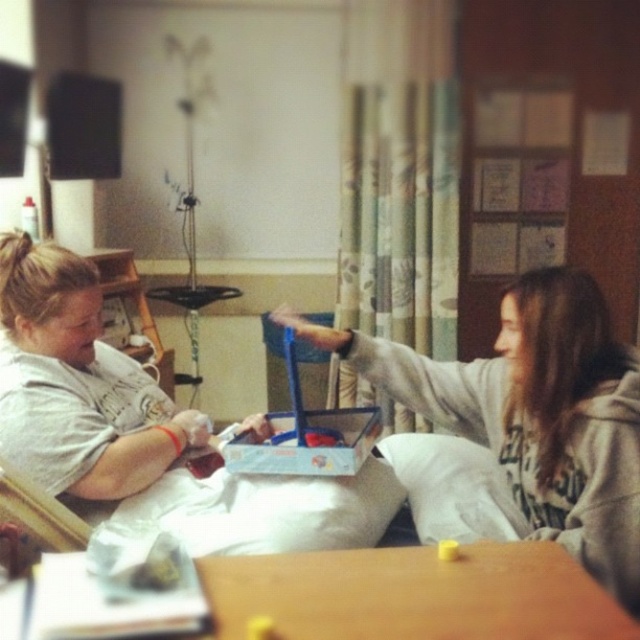
You are a delivery robot trying to locate the gray fleece hoodie at upper right in the room. According to the coordinates provided, where should you move to find it?

The gray fleece hoodie at upper right is located at point (536, 413), so you should move to that coordinate to find it.

Consider the image. You are a delivery robot with a package that needs to be placed on the wooden table at center. The gray fleece hoodie at upper right is in the way. Can you move the package around the hoodie to reach the table?

The distance between the gray fleece hoodie at upper right and the wooden table at center is 21.06 inches. Since the robot needs to navigate around the hoodie, this distance may be sufficient depending on the robot size and maneuverability. If the robot can maneuver within that space, it should be possible to reach the table.